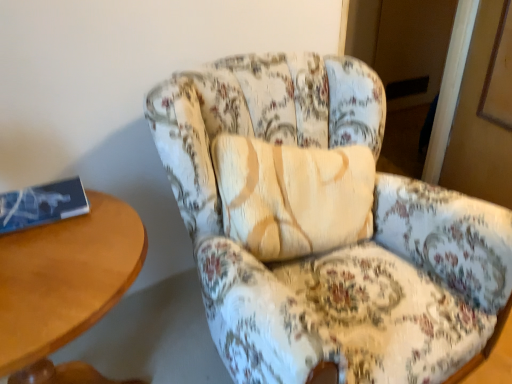
Locate an element on the screen. free spot above wooden table at left (from a real-world perspective) is located at coordinates (55, 256).